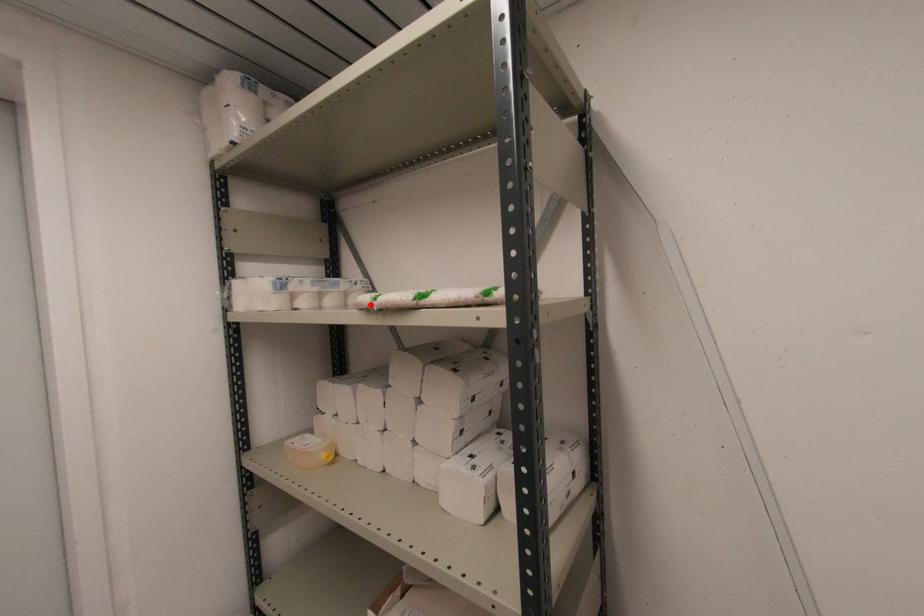
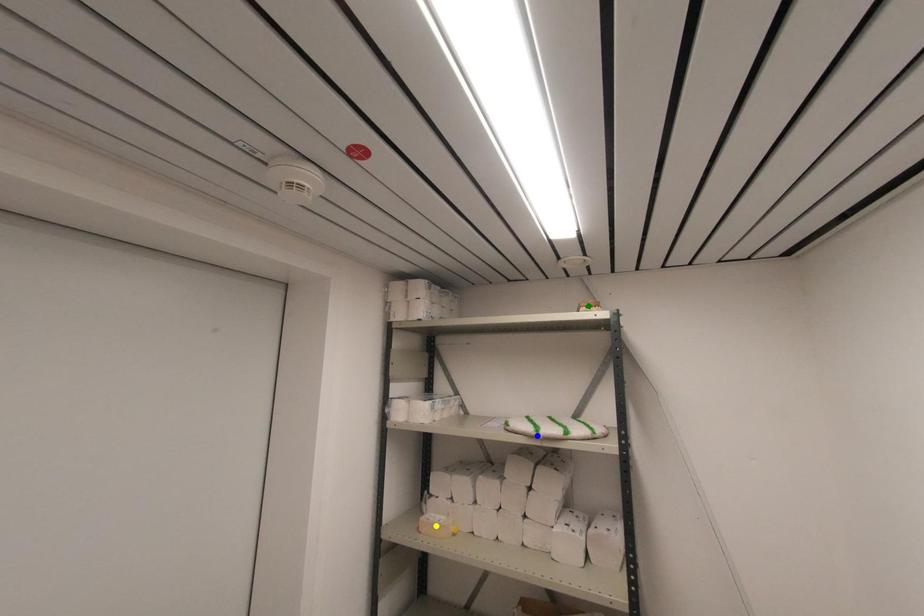
Question: I am providing you with two images of the same scene from different viewpoints. A red point is marked on the first image. You are given multiple points on the second image. In image 2, which mark is for the same physical point as the one in image 1?

Choices:
 (A) green point
 (B) yellow point
 (C) blue point

Answer: (C)